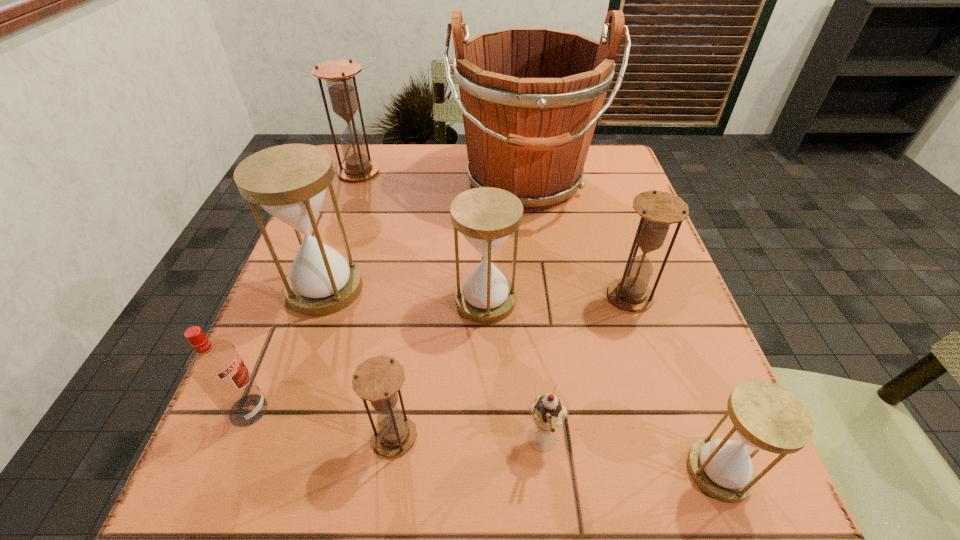
Locate an element on the screen. This screenshot has width=960, height=540. free space between the biggest white hourglass and the vodka is located at coordinates (287, 349).

Identify the location of free spot between the red vodka and the bucket. (386, 297).

In order to click on vacant area that lies between the farthest hourglass and the nearest white hourglass in this screenshot , I will do `click(540, 321)`.

The width and height of the screenshot is (960, 540). Find the location of `vacant region between the tallest object and the second nearest brown hourglass`. vacant region between the tallest object and the second nearest brown hourglass is located at coordinates (577, 240).

Identify which object is the second nearest to the leftmost white hourglass. Please provide its 2D coordinates. Your answer should be formatted as a tuple, i.e. [(x, y)], where the tuple contains the x and y coordinates of a point satisfying the conditions above.

[(486, 216)]

Select which object appears as the fourth closest to the leftmost white hourglass. Please provide its 2D coordinates. Your answer should be formatted as a tuple, i.e. [(x, y)], where the tuple contains the x and y coordinates of a point satisfying the conditions above.

[(377, 379)]

Locate an element on the screen. hourglass that is the second closest to the leftmost white hourglass is located at coordinates (377, 379).

I want to click on hourglass that is the third closest one to the rightmost white hourglass, so click(x=377, y=379).

Locate an element on the screen. This screenshot has width=960, height=540. the second closest brown hourglass relative to the farthest brown hourglass is located at coordinates (377, 379).

Identify which brown hourglass is the second nearest to the second nearest brown hourglass. Please provide its 2D coordinates. Your answer should be formatted as a tuple, i.e. [(x, y)], where the tuple contains the x and y coordinates of a point satisfying the conditions above.

[(338, 74)]